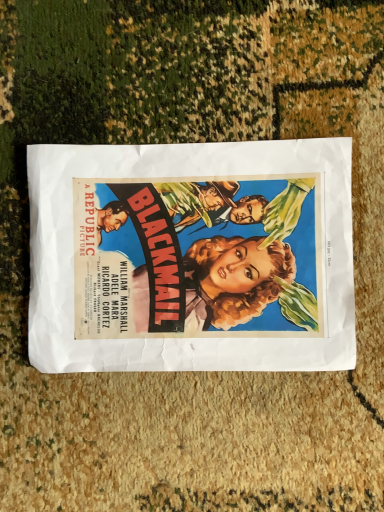
Describe the element at coordinates (191, 257) in the screenshot. I see `matte paper poster at center` at that location.

Locate an element on the screen. matte paper poster at center is located at coordinates (191, 257).

Where is `matte paper poster at center`? matte paper poster at center is located at coordinates (191, 257).